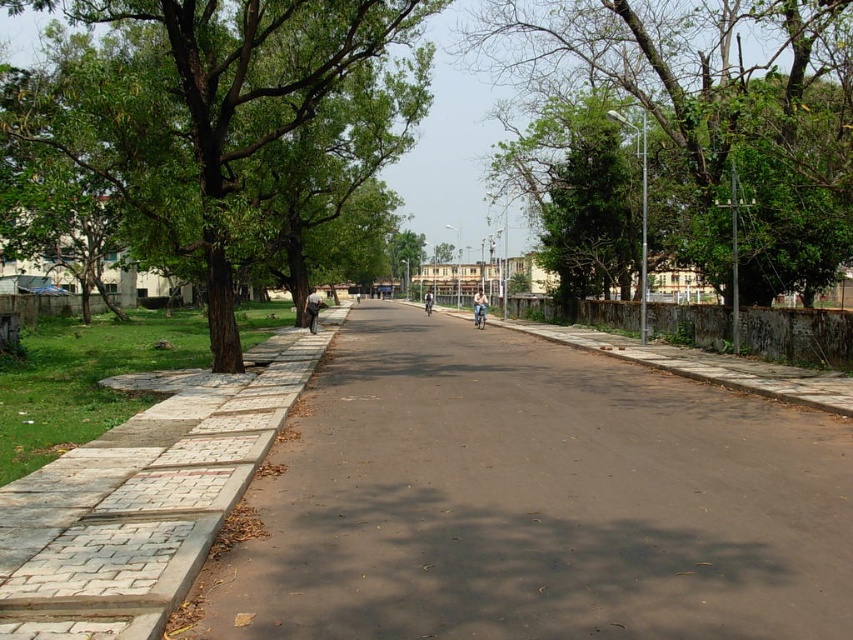
Does green leafy tree at upper right have a smaller size compared to light blue fabric jacket at center?

No, green leafy tree at upper right is not smaller than light blue fabric jacket at center.

The width and height of the screenshot is (853, 640). What do you see at coordinates (695, 120) in the screenshot?
I see `green leafy tree at upper right` at bounding box center [695, 120].

What are the coordinates of `green leafy tree at upper right` in the screenshot? It's located at (695, 120).

Is paved asphalt road at left positioned before green leafy tree at center?

Yes, paved asphalt road at left is closer to the viewer.

Is paved asphalt road at left taller than green leafy tree at center?

In fact, paved asphalt road at left may be shorter than green leafy tree at center.

This screenshot has height=640, width=853. Describe the element at coordinates (531, 500) in the screenshot. I see `paved asphalt road at left` at that location.

I want to click on paved asphalt road at left, so click(x=531, y=500).

Is green leafy tree at upper right taller than dark blue jeans at center?

Yes, green leafy tree at upper right is taller than dark blue jeans at center.

Is point (569, 49) positioned before point (306, 324)?

That is True.

Which is behind, point (529, 54) or point (315, 330)?

The point (529, 54) is behind.

Identify the location of green leafy tree at upper right. This screenshot has width=853, height=640. (695, 120).